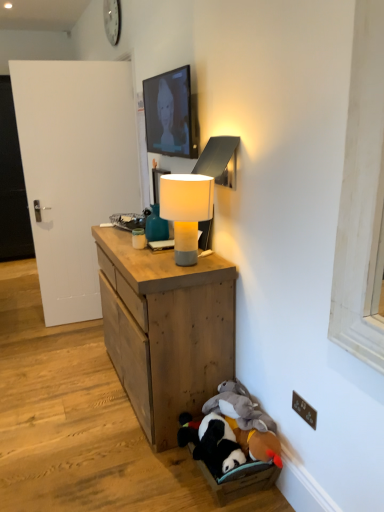
Locate an element on the screen. free space above white matte door at left, the second door in the back-to-front sequence (from a real-world perspective) is located at coordinates (92, 61).